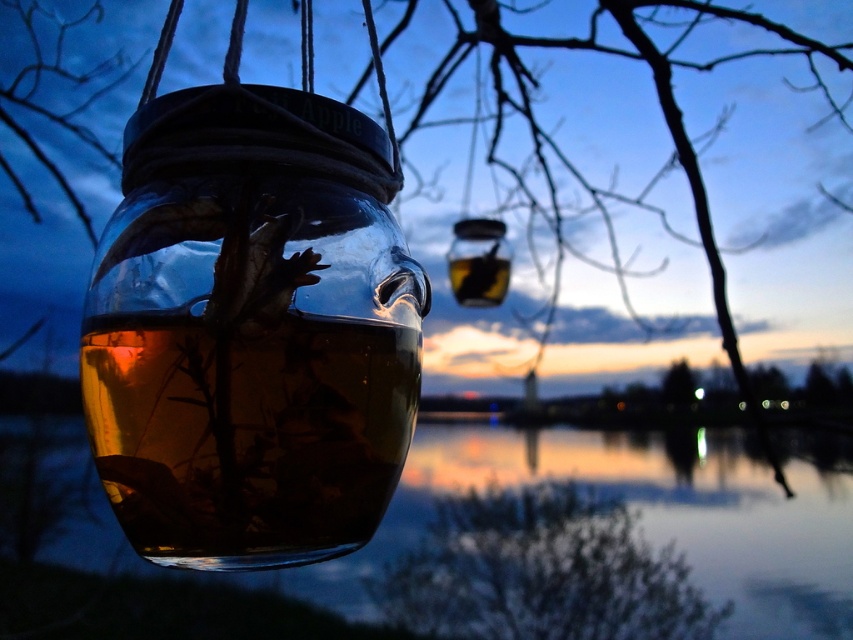
Can you confirm if transparent glass jar at center is smaller than transparent liquid water at jar left?

Yes, transparent glass jar at center is smaller than transparent liquid water at jar left.

Does transparent glass jar at center appear on the right side of transparent liquid water at jar left?

Incorrect, transparent glass jar at center is not on the right side of transparent liquid water at jar left.

Measure the distance between point (399,300) and camera.

Point (399,300) is 7.17 inches from camera.

The width and height of the screenshot is (853, 640). In order to click on transparent glass jar at center in this screenshot , I will do `click(248, 358)`.

Who is positioned more to the left, transparent glass jar at center or brown textured tree at lower center?

transparent glass jar at center is more to the left.

Does transparent glass jar at center have a larger size compared to brown textured tree at lower center?

Correct, transparent glass jar at center is larger in size than brown textured tree at lower center.

Which is behind, point (198, 216) or point (538, 531)?

The point (538, 531) is behind.

Image resolution: width=853 pixels, height=640 pixels. What are the coordinates of `transparent glass jar at center` in the screenshot? It's located at (248, 358).

From the picture: Does transparent liquid water at jar left have a greater width compared to brown textured tree at lower center?

Indeed, transparent liquid water at jar left has a greater width compared to brown textured tree at lower center.

Who is more forward, (749, 518) or (664, 605)?

Point (664, 605) is more forward.

This screenshot has height=640, width=853. I want to click on transparent liquid water at jar left, so click(643, 515).